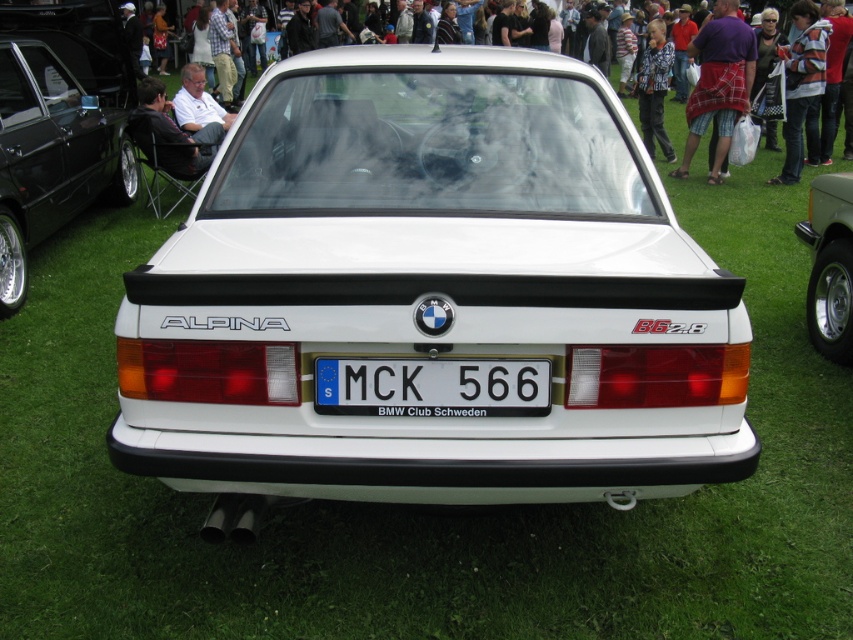
Is shiny black car at left wider than white plastic license plate at center?

In fact, shiny black car at left might be narrower than white plastic license plate at center.

Is point (49, 65) in front of point (352, 364)?

No.

Describe the element at coordinates (57, 125) in the screenshot. This screenshot has height=640, width=853. I see `shiny black car at left` at that location.

You are a GUI agent. You are given a task and a screenshot of the screen. Output one action in this format:
    pyautogui.click(x=<x>, y=<y>)
    Task: Click on the shiny black car at left
    The image size is (853, 640).
    Given the screenshot: What is the action you would take?
    pyautogui.click(x=57, y=125)

Which is more to the right, white plastic license plate at center or plaid fabric kilt at center?

Positioned to the right is plaid fabric kilt at center.

Between white plastic license plate at center and plaid fabric kilt at center, which one is positioned lower?

white plastic license plate at center is below.

Which is in front, point (335, 408) or point (726, 49)?

Point (335, 408)

At what (x,y) coordinates should I click in order to perform the action: click on white plastic license plate at center. Please return your answer as a coordinate pair (x, y). Looking at the image, I should click on (432, 387).

Does striped sweater at upper right appear over light brown leather chair at left?

Yes.

Can you confirm if striped sweater at upper right is positioned to the left of light brown leather chair at left?

No, striped sweater at upper right is not to the left of light brown leather chair at left.

Does point (790, 120) come closer to viewer compared to point (151, 138)?

No.

At what (x,y) coordinates should I click in order to perform the action: click on striped sweater at upper right. Please return your answer as a coordinate pair (x, y). Image resolution: width=853 pixels, height=640 pixels. Looking at the image, I should click on (802, 88).